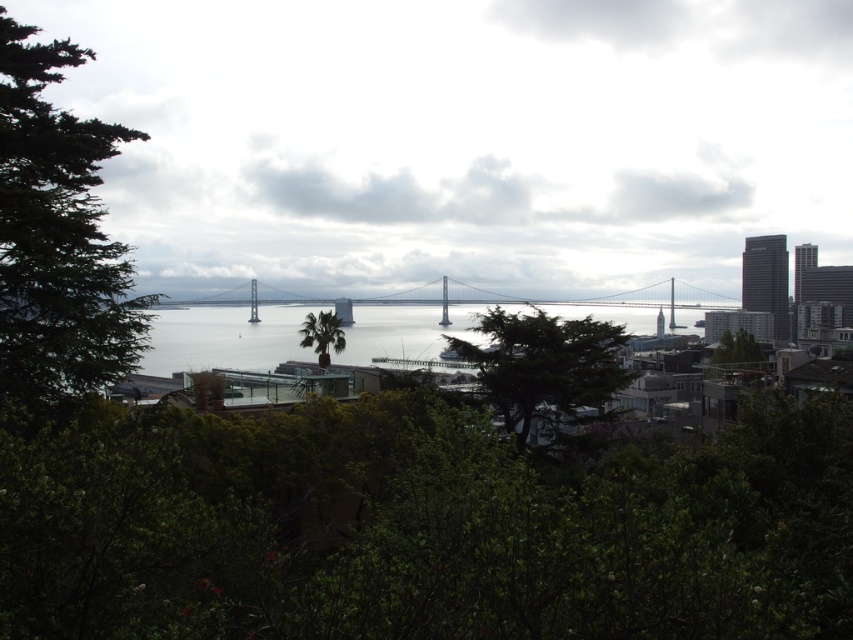
Is transparent glass bridge at center above green leafy tree at center-right?

Yes.

Based on the photo, who is taller, transparent glass bridge at center or green leafy tree at center-right?

transparent glass bridge at center is taller.

Which is behind, point (576, 227) or point (721, 346)?

The point (721, 346) is behind.

Find the location of a particular element. The image size is (853, 640). transparent glass bridge at center is located at coordinates (463, 138).

Which is behind, point (53, 289) or point (239, 314)?

The point (239, 314) is more distant.

Which is more to the right, green leafy tree at left or clear water at center?

Positioned to the right is clear water at center.

Which is behind, point (77, 243) or point (245, 339)?

The point (245, 339) is more distant.

The height and width of the screenshot is (640, 853). In order to click on green leafy tree at left in this screenshot , I will do `click(57, 236)`.

Who is more forward, (x=508, y=288) or (x=57, y=196)?

A: Point (x=57, y=196)

Is transparent glass bridge at center wider than green leafy tree at left?

Yes.

Who is more distant from viewer, (476,173) or (38,380)?

Positioned behind is point (476,173).

You are a GUI agent. You are given a task and a screenshot of the screen. Output one action in this format:
    pyautogui.click(x=<x>, y=<y>)
    Task: Click on the transparent glass bridge at center
    
    Given the screenshot: What is the action you would take?
    tap(463, 138)